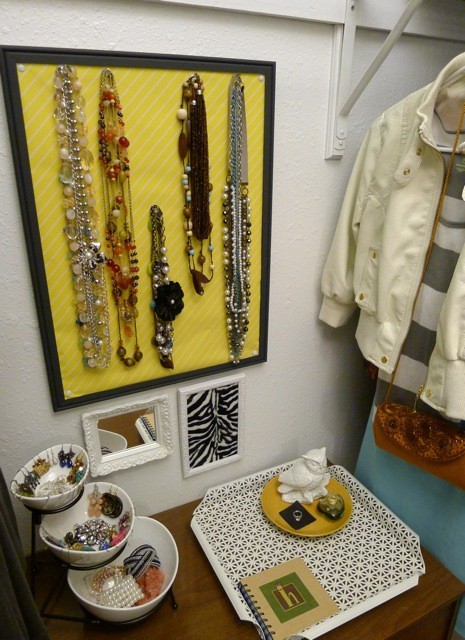
Where is `plate`? This screenshot has height=640, width=465. plate is located at coordinates (317, 529).